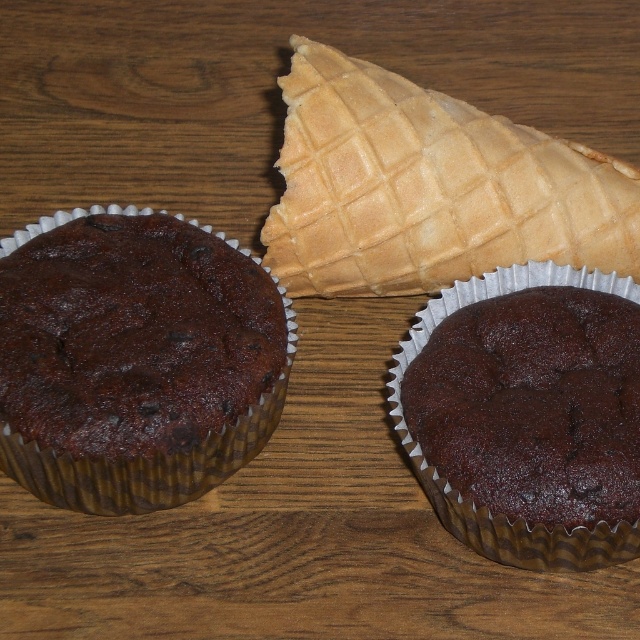
Question: Which of the following is the farthest from the observer?

Choices:
 (A) (161, 467)
 (B) (556, 214)
 (C) (593, 560)

Answer: (B)

Question: Which object appears closest to the camera in this image?

Choices:
 (A) golden-brown waffle cone at upper center
 (B) chocolate matte muffin at left

Answer: (B)

Question: Considering the real-world distances, which object is closest to the dark matte chocolate muffin at center?

Choices:
 (A) chocolate matte muffin at left
 (B) golden-brown waffle cone at upper center

Answer: (B)

Question: Does golden-brown waffle cone at upper center appear on the right side of chocolate matte muffin at left?

Choices:
 (A) yes
 (B) no

Answer: (A)

Question: Does chocolate matte muffin at left have a greater width compared to dark matte chocolate muffin at center?

Choices:
 (A) no
 (B) yes

Answer: (B)

Question: Considering the relative positions of golden-brown waffle cone at upper center and chocolate matte muffin at left in the image provided, where is golden-brown waffle cone at upper center located with respect to chocolate matte muffin at left?

Choices:
 (A) below
 (B) above

Answer: (B)